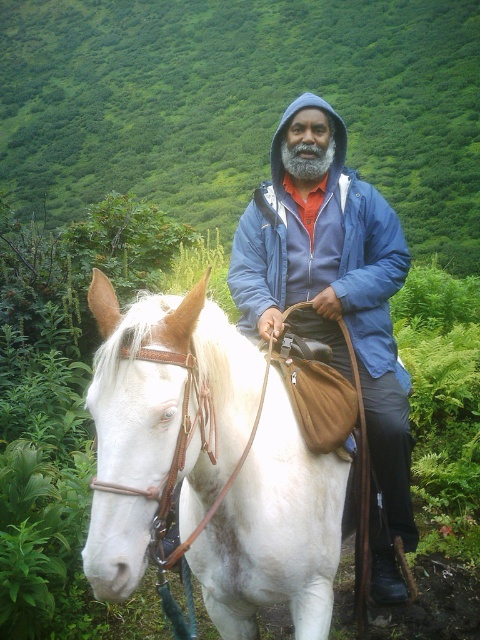
You are navigating a horse through a forest and need to locate a specific point marked on your map. The map indicates that the green leafy hillside at upper center is located at point (240, 104). As you look at the scene, where should you direct your attention to find this hillside?

The green leafy hillside at upper center is located at the coordinates point (240, 104).

You are a hiker planning to cross a river near the white leather horse at center. The green leafy hillside at upper center has a steep slope. Which object would you need to navigate around to avoid getting wet?

The green leafy hillside at upper center is taller than the white leather horse at center, so you should navigate around the green leafy hillside at upper center to avoid getting wet.

You are a hiker planning to take a photo of the green leafy hillside at upper center from point (240, 104). Is the green leafy hillside at upper center visible from that point?

Yes, the green leafy hillside at upper center is located exactly at point (240, 104), so it is visible from that point.